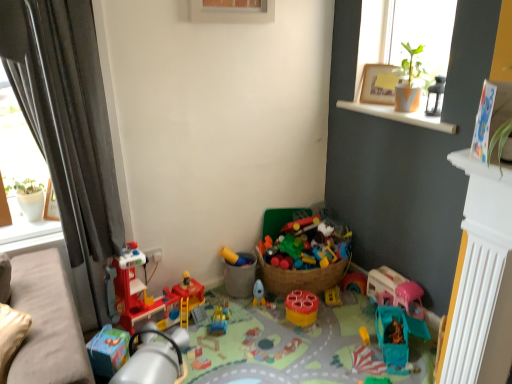
You are a GUI agent. You are given a task and a screenshot of the screen. Output one action in this format:
    pyautogui.click(x=<x>, y=<y>)
    Task: Click on the free location to the left of pink plastic toy at lower right, positioned as the 1th toy in right-to-left order
    The image size is (512, 384).
    Given the screenshot: What is the action you would take?
    coord(351,307)